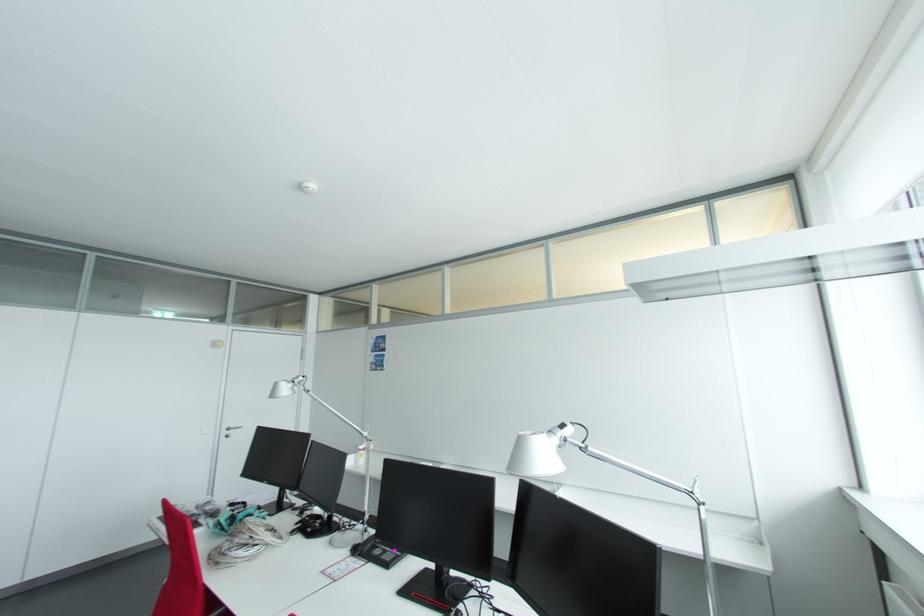
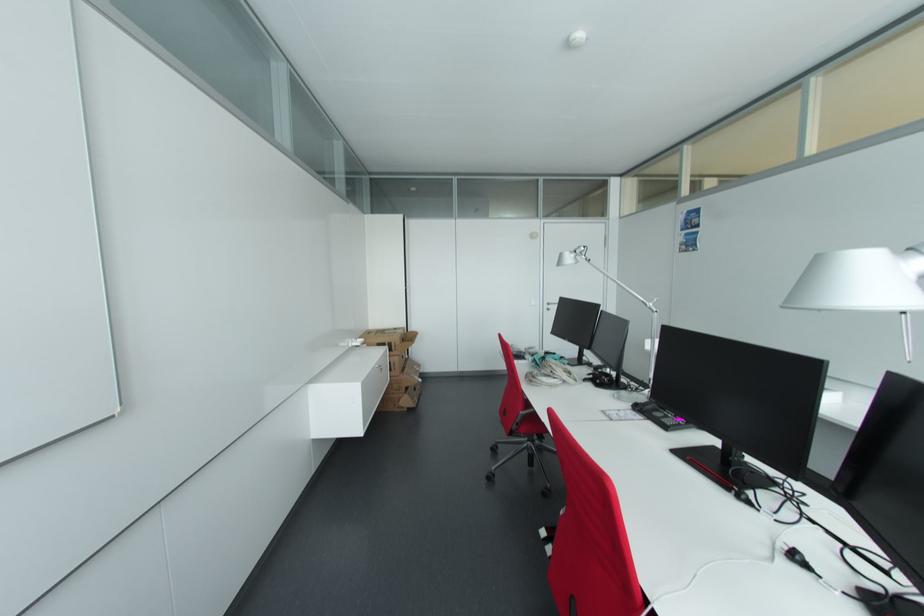
Where in the second image is the point corresponding to [553,432] from the first image?

(913, 249)